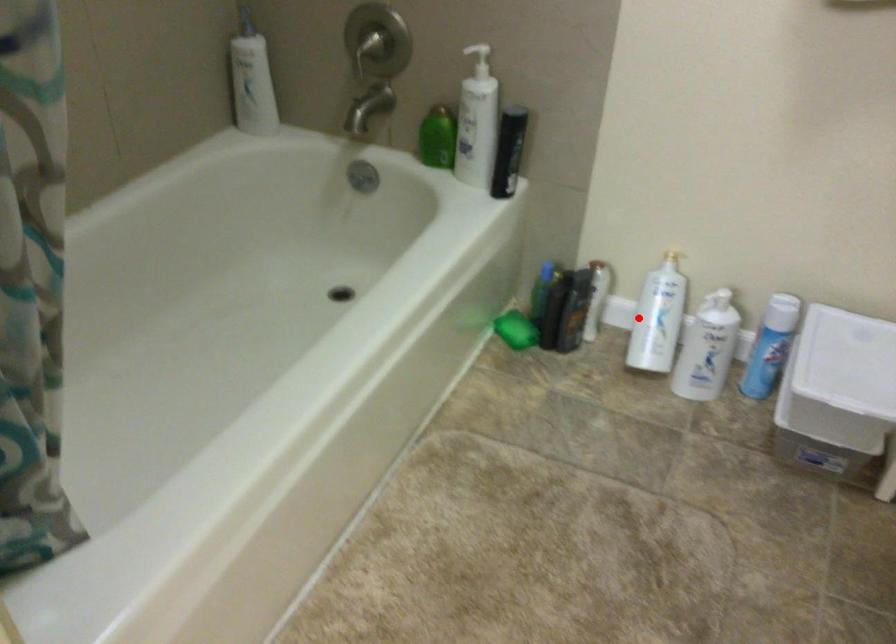
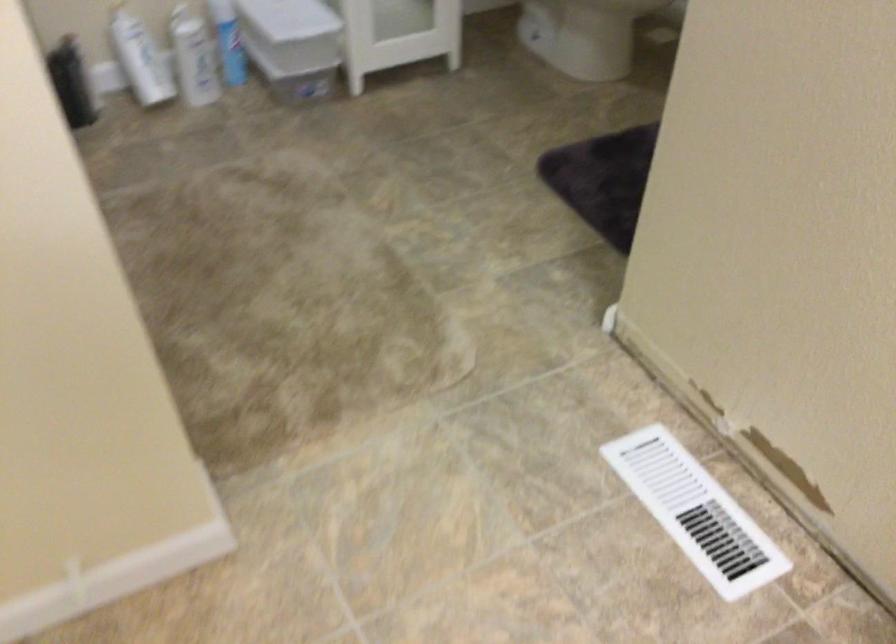
Question: I am providing you with two images of the same scene from different viewpoints. Image1 has a red point marked. In image2, the corresponding 3D location appears at what relative position? Reply with the corresponding letter.

Choices:
 (A) Closer
 (B) Farther

Answer: (B)